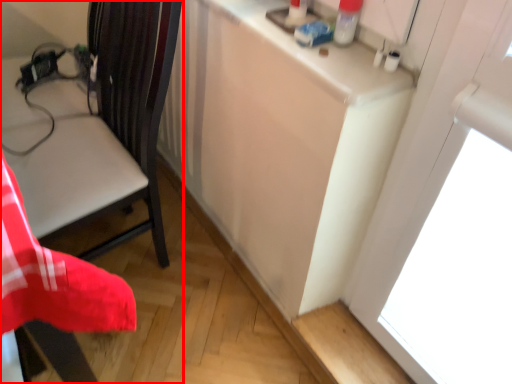
Question: From the image, what is the correct spatial relationship of chair (annotated by the red box) in relation to counter top?

Choices:
 (A) right
 (B) left

Answer: (B)